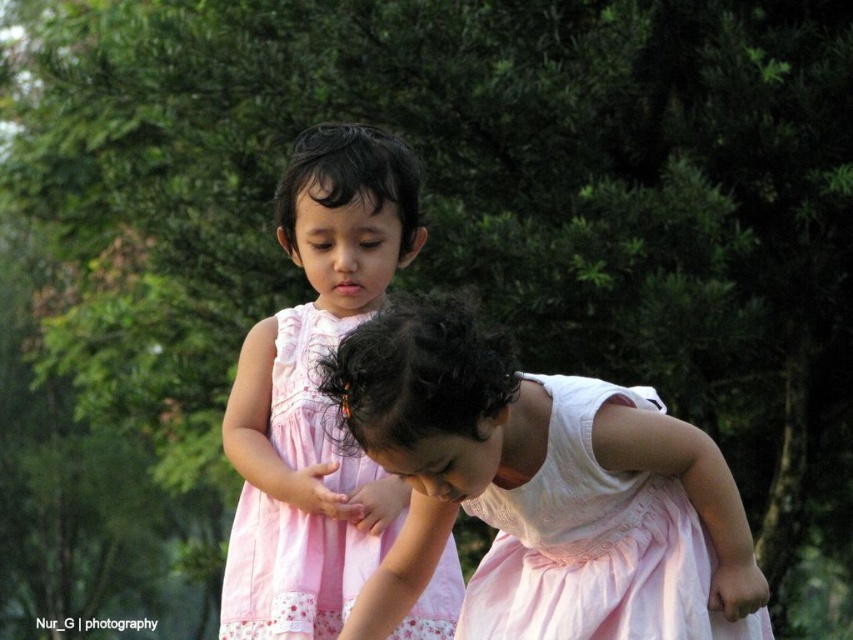
You are standing at the point labeled as point [459,632] in the image. You want to walk to the nearest tree located 10 feet away from your current position. Can you reach the tree without moving more than 10 feet?

The point labeled as point [459,632] is 10.44 feet away from the viewer. Since the tree is 10 feet away from the point, the total distance would be 10.44 feet plus 10 feet, which exceeds the 10 feet limit. Therefore, you cannot reach the tree without moving more than 10 feet.

You are a photographer setting up for a family photo. You need to position two children wearing the pink satin dress at center and the pink cotton dress at center so that both can fit comfortably within a 1.5 meter wide frame. Based on their dress widths, can they both stand side by side without overlapping?

The pink satin dress at center might be wider than the pink cotton dress at center. If the pink satin dress at center is indeed wider, their combined width could exceed 1.5 meters, making it difficult to fit them side by side. However, if the width difference is minimal, they might just fit. The exact arrangement depends on the actual width measurements of both dresses.